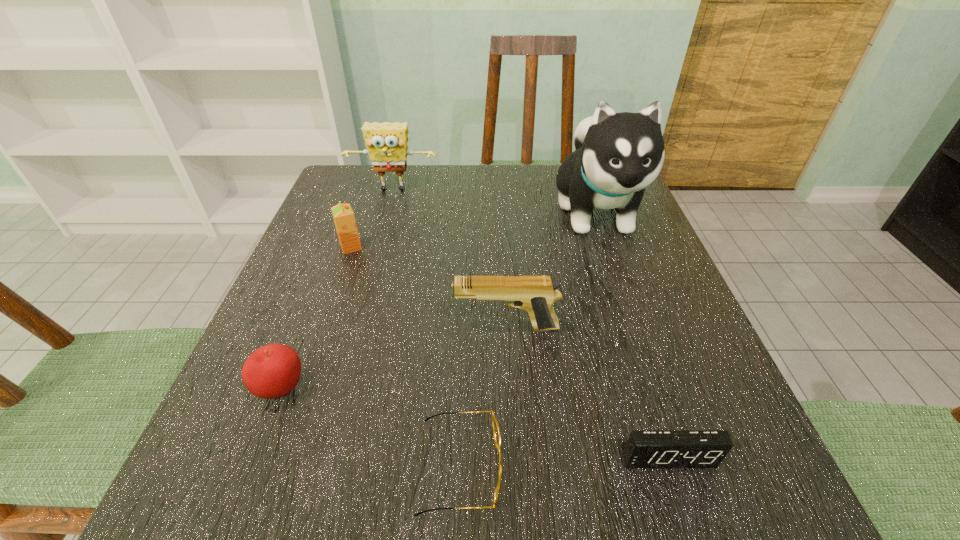
In the image, there is a desktop. Where is `free region at the left edge`? This screenshot has width=960, height=540. free region at the left edge is located at coordinates coord(312,314).

Find the location of a particular element. The height and width of the screenshot is (540, 960). free region at the right edge is located at coordinates (610, 305).

In the image, there is a desktop. Where is `vacant space at the far left corner`? The width and height of the screenshot is (960, 540). vacant space at the far left corner is located at coordinates (329, 215).

Find the location of a particular element. This screenshot has height=540, width=960. free point at the far right corner is located at coordinates (611, 215).

This screenshot has width=960, height=540. I want to click on free space between the fourth nearest object and the shortest object, so click(483, 397).

Identify the location of vacant area that lies between the tallest object and the orange juice. The image size is (960, 540). point(473,229).

Identify the location of empty space between the puppy and the apple. The image size is (960, 540). (439, 300).

Identify the location of unoccupied area between the shortest object and the orange juice. This screenshot has height=540, width=960. (406, 356).

What are the coordinates of `empty space that is in between the shortest object and the orange juice` in the screenshot? It's located at (406, 356).

You are a GUI agent. You are given a task and a screenshot of the screen. Output one action in this format:
    pyautogui.click(x=<x>, y=<y>)
    Task: Click on the empty space between the alarm clock and the orange juice
    The width and height of the screenshot is (960, 540).
    Given the screenshot: What is the action you would take?
    pyautogui.click(x=509, y=352)